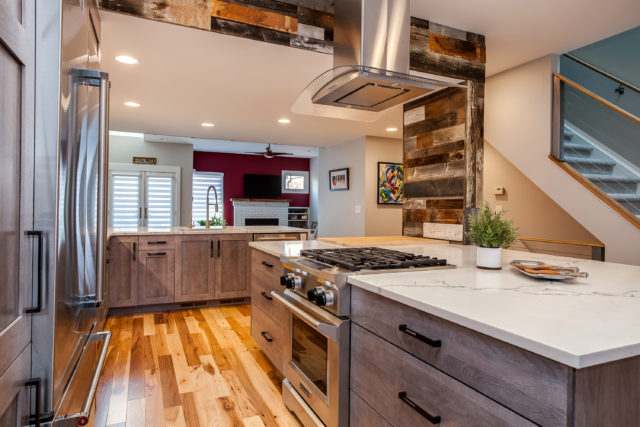
Image resolution: width=640 pixels, height=427 pixels. What are the coordinates of `stove dials` in the screenshot? It's located at click(280, 278), click(290, 280), click(310, 293), click(321, 298).